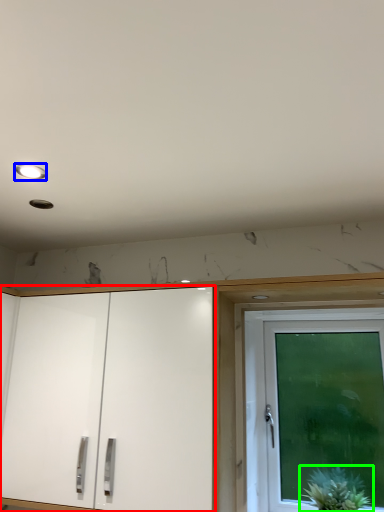
Question: Which object is positioned closest to cabinetry (highlighted by a red box)? Select from lighting (highlighted by a blue box) and houseplant (highlighted by a green box).

Choices:
 (A) lighting
 (B) houseplant

Answer: (B)